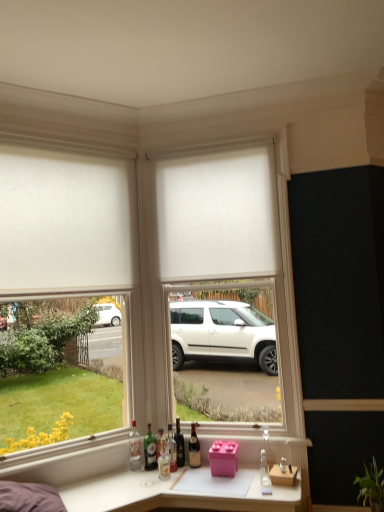
This screenshot has height=512, width=384. What are the coordinates of `space that is in front of clear glass bottle at center, positioned as the seventh bottle in left-to-right order` in the screenshot? It's located at (266, 493).